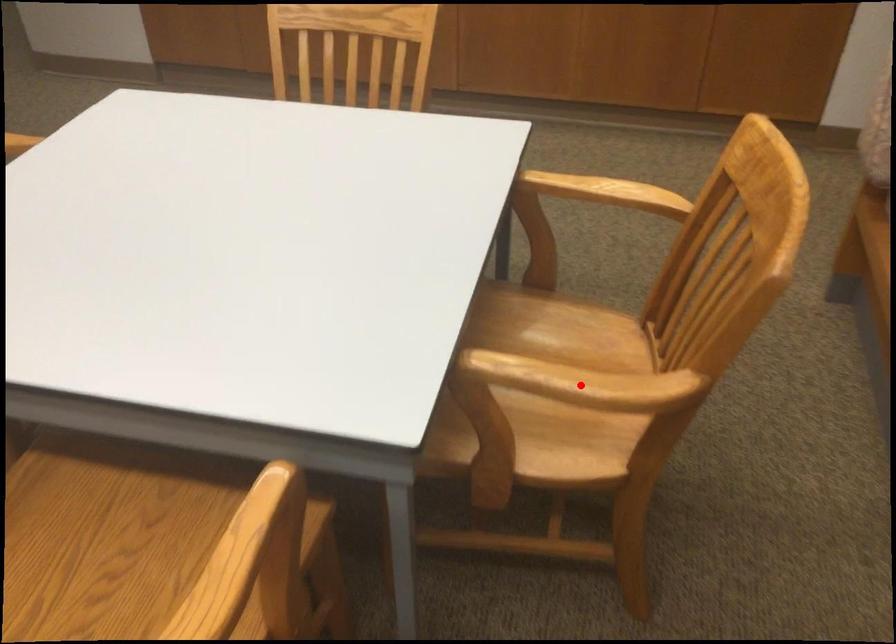
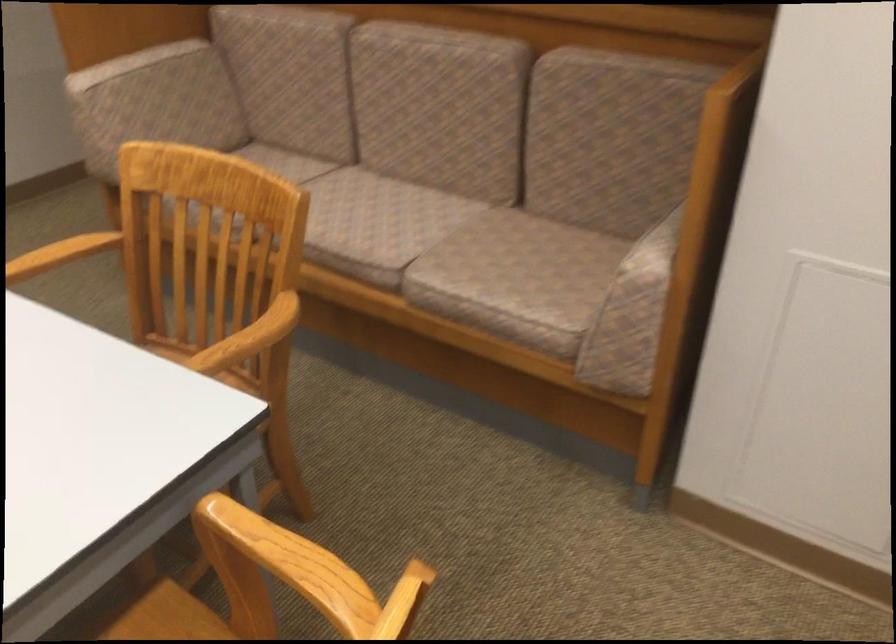
In the second image, find the point that corresponds to the highlighted location in the first image.

(248, 339)